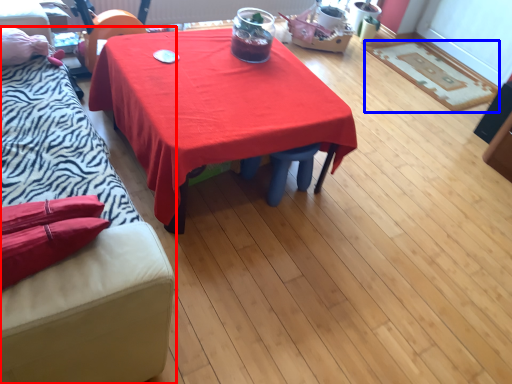
Question: Which object appears closest to the camera in this image, studio couch (highlighted by a red box) or mat (highlighted by a blue box)?

Choices:
 (A) studio couch
 (B) mat

Answer: (A)